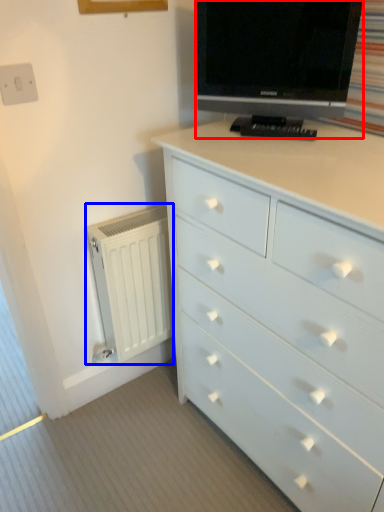
Question: Which of the following is the farthest to the observer, television (highlighted by a red box) or radiator (highlighted by a blue box)?

Choices:
 (A) television
 (B) radiator

Answer: (B)